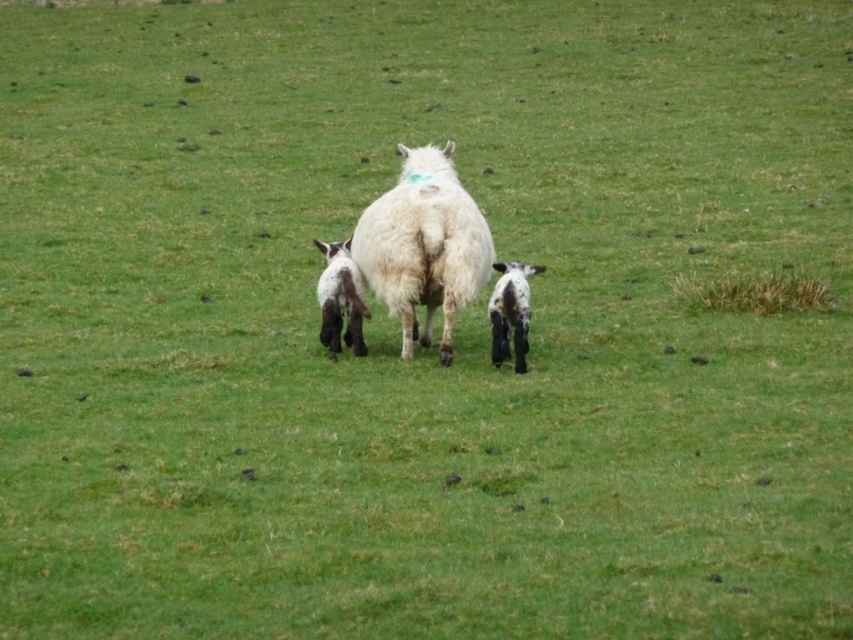
You are a farmer checking the health of your animals. You notice the white fluffy sheep at center and the black woolen lamb at center. Which animal has a greater width?

The white fluffy sheep at center has a greater width than the black woolen lamb at center.

You are a farmer checking your flock in the field. You notice the white fluffy sheep at center and the black woolen lamb at center. Which one is more to the right?

The white fluffy sheep at center is positioned on the right side of the black woolen lamb at center, so it is more to the right.